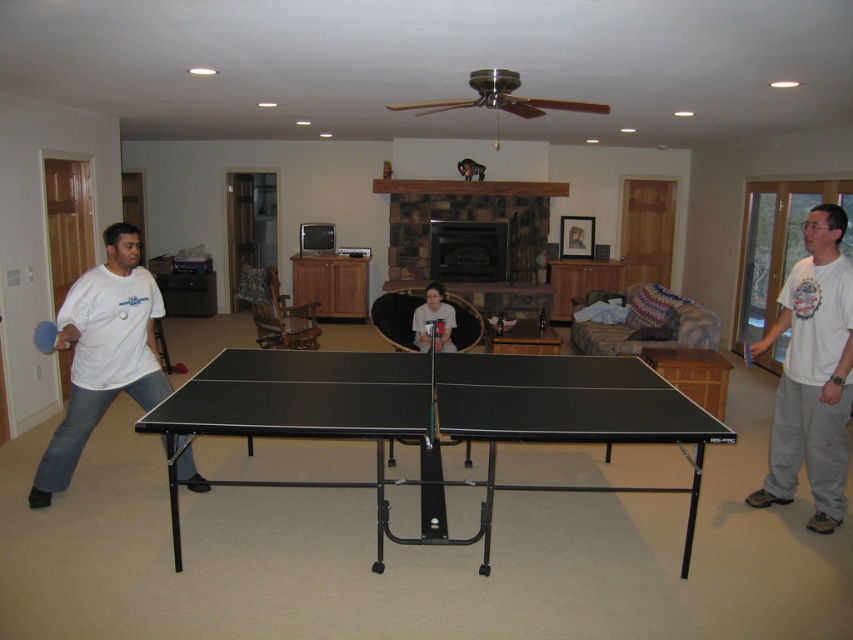
Between black matte table tennis table at center and matte white shirt at center, which one is positioned lower?

black matte table tennis table at center is lower down.

Does black matte table tennis table at center have a greater height compared to matte white shirt at center?

Correct, black matte table tennis table at center is much taller as matte white shirt at center.

Between point (235, 349) and point (436, 336), which one is positioned in front?

Point (235, 349) is in front.

What are the coordinates of `black matte table tennis table at center` in the screenshot? It's located at (439, 416).

Which of these two, white cotton shirt at right or blue rubber table tennis at center, stands shorter?

blue rubber table tennis at center

Looking at this image, measure the distance between point [816,208] and camera.

Point [816,208] is 3.61 meters away from camera.

Is point (751, 497) farther from camera compared to point (747, 344)?

Yes, point (751, 497) is farther from viewer.

In order to click on white cotton shirt at right in this screenshot , I will do `click(811, 374)`.

Find the location of a particular element. Image resolution: width=853 pixels, height=640 pixels. matte white shirt at left is located at coordinates (103, 353).

Describe the element at coordinates (103, 353) in the screenshot. I see `matte white shirt at left` at that location.

Where is `matte white shirt at left`? matte white shirt at left is located at coordinates (103, 353).

The image size is (853, 640). Find the location of `matte white shirt at left`. matte white shirt at left is located at coordinates (103, 353).